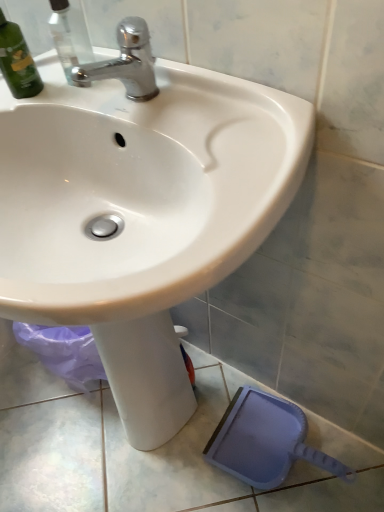
Identify the location of free space to the left of chrome metallic faucet at upper center. (70, 96).